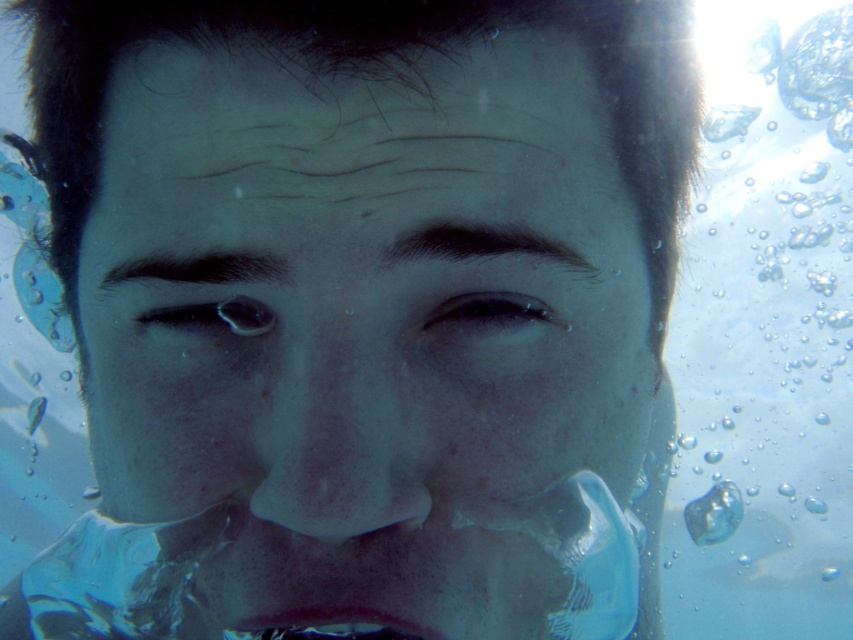
Does smooth skin nose at center have a larger size compared to translucent blue lips at lower center?

Correct, smooth skin nose at center is larger in size than translucent blue lips at lower center.

Between smooth skin nose at center and translucent blue lips at lower center, which one appears on the right side from the viewer's perspective?

smooth skin nose at center

This screenshot has width=853, height=640. Describe the element at coordinates (343, 426) in the screenshot. I see `smooth skin nose at center` at that location.

This screenshot has width=853, height=640. I want to click on smooth skin nose at center, so click(343, 426).

Who is more distant from viewer, (491,480) or (428,634)?

The point (491,480) is more distant.

Who is positioned more to the left, matte skin face at center or translucent blue lips at lower center?

translucent blue lips at lower center is more to the left.

Find the location of a particular element. The image size is (853, 640). matte skin face at center is located at coordinates (364, 326).

Is matte skin face at center positioned behind smooth skin nose at center?

No.

The width and height of the screenshot is (853, 640). What do you see at coordinates (364, 326) in the screenshot? I see `matte skin face at center` at bounding box center [364, 326].

The height and width of the screenshot is (640, 853). Find the location of `matte skin face at center`. matte skin face at center is located at coordinates (364, 326).